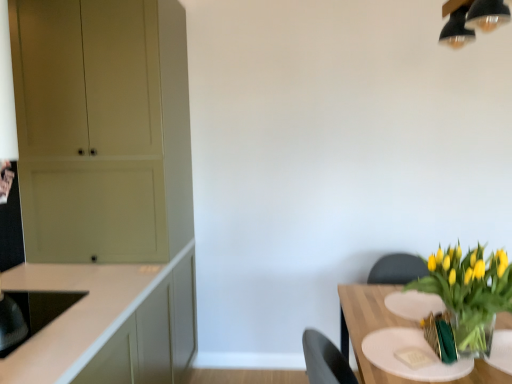
Question: Is translucent glass table at lower right oriented towards black glossy sink at lower left?

Choices:
 (A) no
 (B) yes

Answer: (A)

Question: From the image's perspective, does translucent glass table at lower right appear lower than black glossy sink at lower left?

Choices:
 (A) no
 (B) yes

Answer: (B)

Question: Is translucent glass table at lower right to the left of black glossy sink at lower left from the viewer's perspective?

Choices:
 (A) yes
 (B) no

Answer: (B)

Question: From a real-world perspective, is translucent glass table at lower right physically above black glossy sink at lower left?

Choices:
 (A) no
 (B) yes

Answer: (A)

Question: Considering the relative sizes of translucent glass table at lower right and black glossy sink at lower left in the image provided, is translucent glass table at lower right shorter than black glossy sink at lower left?

Choices:
 (A) yes
 (B) no

Answer: (B)

Question: From a real-world perspective, is translucent glass table at lower right located beneath black glossy sink at lower left?

Choices:
 (A) yes
 (B) no

Answer: (A)

Question: Is the depth of translucent glass vase at lower right greater than that of white matte cabinet at left, arranged as the second cabinetry when viewed from the back?

Choices:
 (A) no
 (B) yes

Answer: (B)

Question: Considering the relative positions of translucent glass vase at lower right and white matte cabinet at left, positioned as the 1th cabinetry in front-to-back order, in the image provided, is translucent glass vase at lower right to the right of white matte cabinet at left, positioned as the 1th cabinetry in front-to-back order, from the viewer's perspective?

Choices:
 (A) yes
 (B) no

Answer: (A)

Question: Is translucent glass vase at lower right outside of white matte cabinet at left, arranged as the second cabinetry when viewed from the back?

Choices:
 (A) no
 (B) yes

Answer: (B)

Question: Does translucent glass vase at lower right touch white matte cabinet at left, arranged as the second cabinetry when viewed from the back?

Choices:
 (A) no
 (B) yes

Answer: (A)

Question: Is translucent glass vase at lower right positioned with its back to white matte cabinet at left, arranged as the second cabinetry when viewed from the back?

Choices:
 (A) no
 (B) yes

Answer: (B)

Question: Can you confirm if translucent glass vase at lower right is smaller than white matte cabinet at left, positioned as the 1th cabinetry in front-to-back order?

Choices:
 (A) yes
 (B) no

Answer: (A)

Question: From the image's perspective, is black glossy sink at lower left on top of white matte cabinet at left, arranged as the second cabinetry when viewed from the back?

Choices:
 (A) no
 (B) yes

Answer: (B)